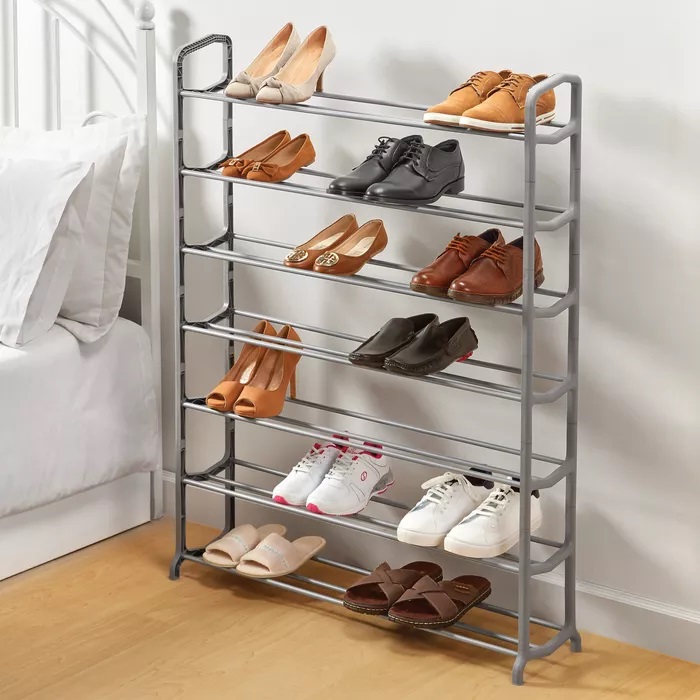
The image size is (700, 700). I want to click on shoe on seventh shelf down, so click(421, 603), click(379, 587), click(257, 558), click(232, 546).